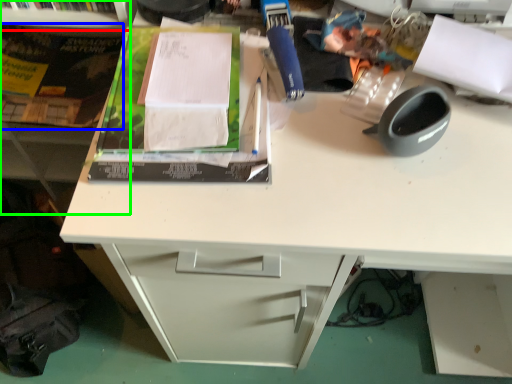
Question: Considering the real-world distances, which object is closest to shelf (highlighted by a red box)? paperback book (highlighted by a blue box) or bookshelf (highlighted by a green box).

Choices:
 (A) paperback book
 (B) bookshelf

Answer: (B)